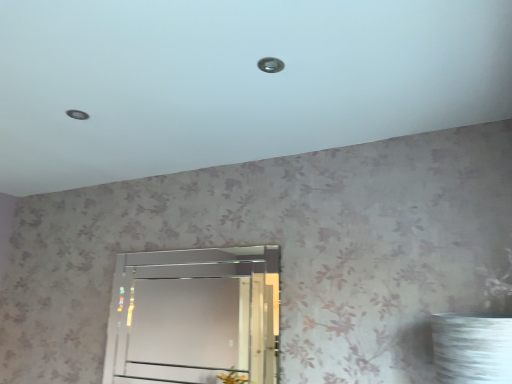
Describe the element at coordinates (194, 316) in the screenshot. I see `clear glass mirror at center` at that location.

Locate an element on the screen. The width and height of the screenshot is (512, 384). clear glass mirror at center is located at coordinates (194, 316).

You are a GUI agent. You are given a task and a screenshot of the screen. Output one action in this format:
    pyautogui.click(x=<x>, y=<y>)
    Task: Click on the clear glass mirror at center
    The width and height of the screenshot is (512, 384).
    Given the screenshot: What is the action you would take?
    pyautogui.click(x=194, y=316)